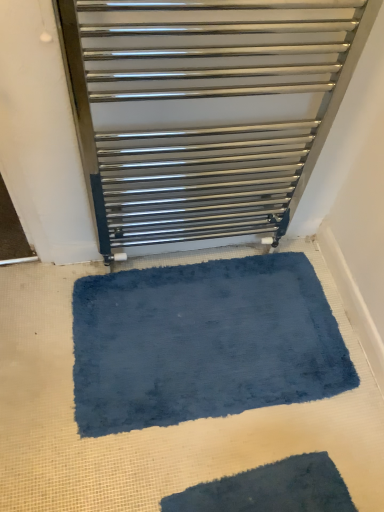
Question: From the image's perspective, would you say dark blue shaggy bath mat at lower center, positioned as the second bath mat in back-to-front order, is positioned over satin silver towel rail at upper center?

Choices:
 (A) yes
 (B) no

Answer: (B)

Question: Is dark blue shaggy bath mat at lower center, positioned as the second bath mat in back-to-front order, taller than satin silver towel rail at upper center?

Choices:
 (A) yes
 (B) no

Answer: (B)

Question: From a real-world perspective, is dark blue shaggy bath mat at lower center, marked as the first bath mat in a bottom-to-top arrangement, under satin silver towel rail at upper center?

Choices:
 (A) no
 (B) yes

Answer: (B)

Question: Are dark blue shaggy bath mat at lower center, which ranks as the first bath mat in front-to-back order, and satin silver towel rail at upper center far apart?

Choices:
 (A) yes
 (B) no

Answer: (B)

Question: From the image's perspective, is dark blue shaggy bath mat at lower center, which appears as the second bath mat when viewed from the top, under satin silver towel rail at upper center?

Choices:
 (A) no
 (B) yes

Answer: (B)

Question: From the image's perspective, is dark blue shaggy bath mat at lower center, which appears as the second bath mat when viewed from the top, located above or below blue plush bath mat at center, the 1th bath mat positioned from the back?

Choices:
 (A) below
 (B) above

Answer: (A)

Question: Visually, is dark blue shaggy bath mat at lower center, marked as the first bath mat in a bottom-to-top arrangement, positioned to the left or to the right of blue plush bath mat at center, the 1th bath mat positioned from the back?

Choices:
 (A) left
 (B) right

Answer: (B)

Question: Considering the positions of point (162, 504) and point (240, 394), is point (162, 504) closer or farther from the camera than point (240, 394)?

Choices:
 (A) farther
 (B) closer

Answer: (B)

Question: Relative to blue plush bath mat at center, which appears as the first bath mat when viewed from the top, is dark blue shaggy bath mat at lower center, which appears as the second bath mat when viewed from the top, in front or behind?

Choices:
 (A) front
 (B) behind

Answer: (A)

Question: Looking at their shapes, would you say dark blue shaggy bath mat at lower center, marked as the first bath mat in a bottom-to-top arrangement, is wider or thinner than satin silver towel rail at upper center?

Choices:
 (A) wide
 (B) thin

Answer: (A)

Question: Considering the positions of dark blue shaggy bath mat at lower center, which ranks as the first bath mat in front-to-back order, and satin silver towel rail at upper center in the image, is dark blue shaggy bath mat at lower center, which ranks as the first bath mat in front-to-back order, bigger or smaller than satin silver towel rail at upper center?

Choices:
 (A) big
 (B) small

Answer: (B)

Question: Considering the positions of dark blue shaggy bath mat at lower center, positioned as the second bath mat in back-to-front order, and satin silver towel rail at upper center in the image, is dark blue shaggy bath mat at lower center, positioned as the second bath mat in back-to-front order, taller or shorter than satin silver towel rail at upper center?

Choices:
 (A) tall
 (B) short

Answer: (B)

Question: Considering the positions of point (307, 505) and point (135, 175), is point (307, 505) closer or farther from the camera than point (135, 175)?

Choices:
 (A) farther
 (B) closer

Answer: (B)

Question: Is blue plush bath mat at center, which appears as the first bath mat when viewed from the top, spatially inside dark blue shaggy bath mat at lower center, positioned as the second bath mat in back-to-front order, or outside of it?

Choices:
 (A) outside
 (B) inside

Answer: (A)

Question: From the image's perspective, is blue plush bath mat at center, the 1th bath mat positioned from the back, located above or below dark blue shaggy bath mat at lower center, which appears as the second bath mat when viewed from the top?

Choices:
 (A) below
 (B) above

Answer: (B)